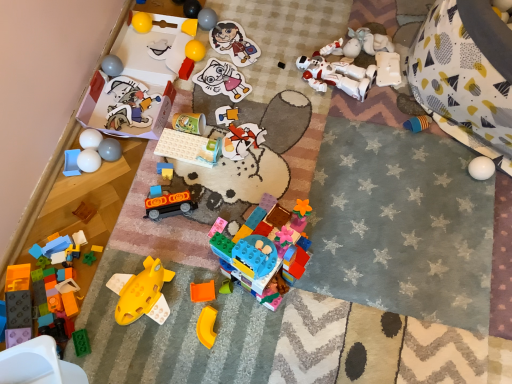
I want to click on empty space that is in between translucent orange plastic at center, arranged as the nineteenth toy when viewed from the left, and smooth yellow ball at upper center, the ninth toy from the right, so click(x=213, y=127).